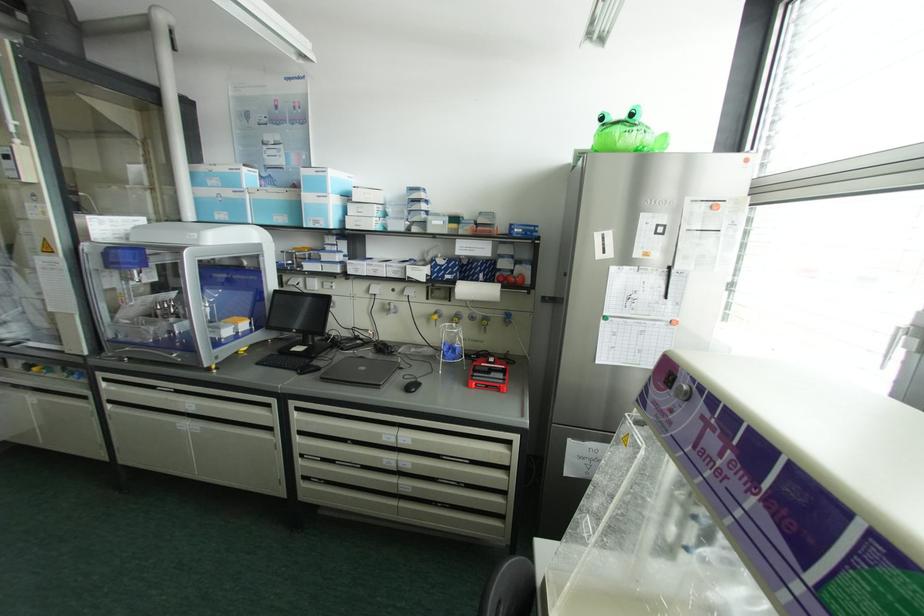
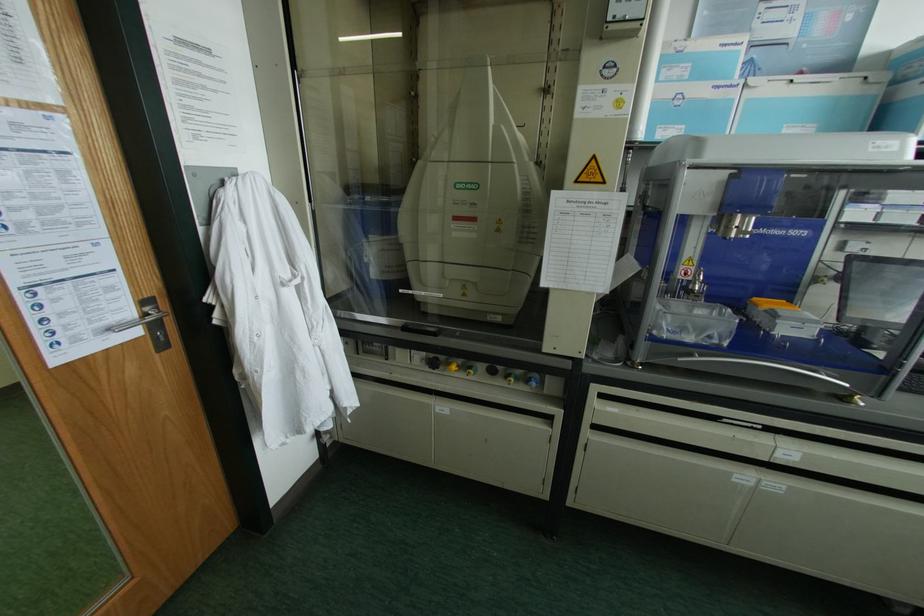
Where in the second image is the point corresponding to the point at 29,367 from the first image?

(432, 363)